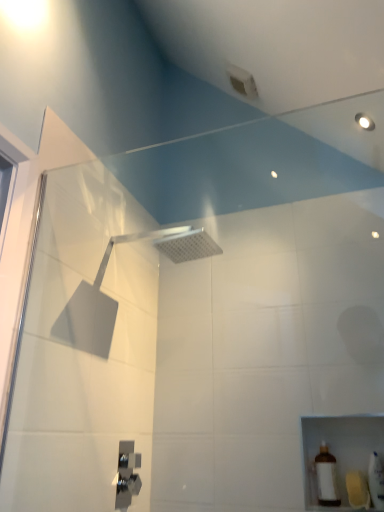
Question: From a real-world perspective, is white glossy bottle at lower right, acting as the first toiletry starting from the right, physically below satin nickel faucet at lower center, placed as the second shower when sorted from top to bottom?

Choices:
 (A) yes
 (B) no

Answer: (A)

Question: Is the position of white glossy bottle at lower right, acting as the first toiletry starting from the right, more distant than that of satin nickel faucet at lower center, placed as the second shower when sorted from top to bottom?

Choices:
 (A) no
 (B) yes

Answer: (A)

Question: Is satin nickel faucet at lower center, marked as the first shower in a left-to-right arrangement, located within white glossy bottle at lower right, acting as the first toiletry starting from the right?

Choices:
 (A) yes
 (B) no

Answer: (B)

Question: Does white glossy bottle at lower right, the second toiletry when ordered from left to right, have a lesser width compared to satin nickel faucet at lower center, marked as the first shower in a left-to-right arrangement?

Choices:
 (A) yes
 (B) no

Answer: (B)

Question: Is white glossy bottle at lower right, the second toiletry when ordered from left to right, completely or partially outside of satin nickel faucet at lower center, placed as the second shower when sorted from top to bottom?

Choices:
 (A) no
 (B) yes

Answer: (B)

Question: Is satin nickel faucet at lower center, marked as the first shower in a left-to-right arrangement, taller or shorter than white glossy bottle at lower right, acting as the first toiletry starting from the right?

Choices:
 (A) tall
 (B) short

Answer: (A)

Question: Is point (117, 487) positioned closer to the camera than point (370, 478)?

Choices:
 (A) closer
 (B) farther

Answer: (B)

Question: From the image's perspective, is satin nickel faucet at lower center, marked as the first shower in a left-to-right arrangement, above or below white glossy bottle at lower right, acting as the first toiletry starting from the right?

Choices:
 (A) above
 (B) below

Answer: (B)

Question: Is satin nickel faucet at lower center, acting as the first shower starting from the bottom, bigger or smaller than white glossy bottle at lower right, acting as the first toiletry starting from the right?

Choices:
 (A) small
 (B) big

Answer: (A)

Question: In terms of height, does white glossy bottle at lower right, acting as the first toiletry starting from the right, look taller or shorter compared to satin nickel faucet at lower center, placed as the second shower when sorted from top to bottom?

Choices:
 (A) short
 (B) tall

Answer: (A)

Question: Which is correct: white glossy bottle at lower right, the second toiletry when ordered from left to right, is inside satin nickel faucet at lower center, acting as the first shower starting from the bottom, or outside of it?

Choices:
 (A) inside
 (B) outside

Answer: (B)

Question: Based on their sizes in the image, would you say white glossy bottle at lower right, acting as the first toiletry starting from the right, is bigger or smaller than satin nickel faucet at lower center, marked as the first shower in a left-to-right arrangement?

Choices:
 (A) big
 (B) small

Answer: (A)

Question: Considering the positions of point (377, 507) and point (124, 490), is point (377, 507) closer or farther from the camera than point (124, 490)?

Choices:
 (A) farther
 (B) closer

Answer: (B)

Question: From the image's perspective, relative to silver metallic shower head at upper center, marked as the second shower in a bottom-to-top arrangement, is white glossy bottle at lower right, acting as the first toiletry starting from the right, above or below?

Choices:
 (A) above
 (B) below

Answer: (B)

Question: Would you say white glossy bottle at lower right, acting as the first toiletry starting from the right, is inside or outside silver metallic shower head at upper center, the first shower from the top?

Choices:
 (A) inside
 (B) outside

Answer: (B)